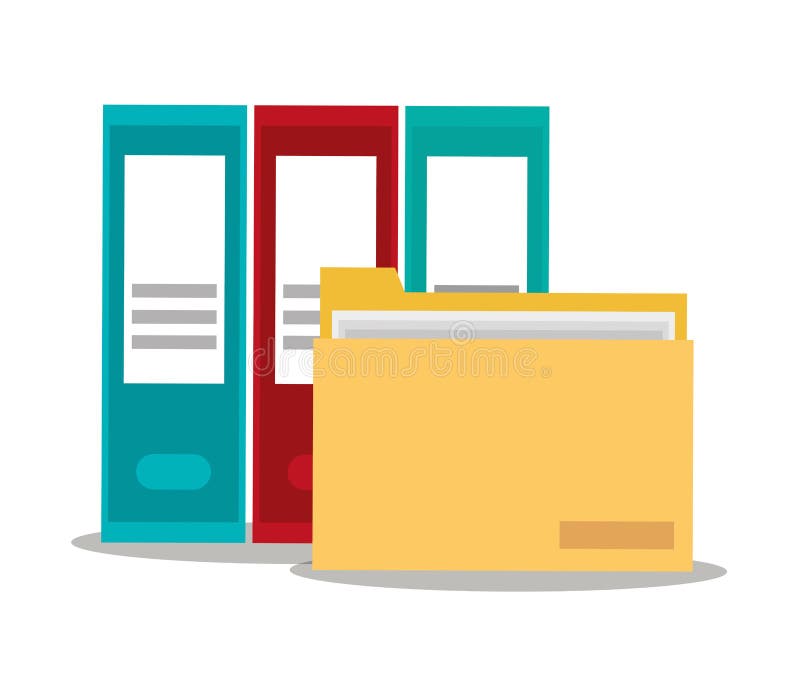
I want to click on red book, so click(x=309, y=134).